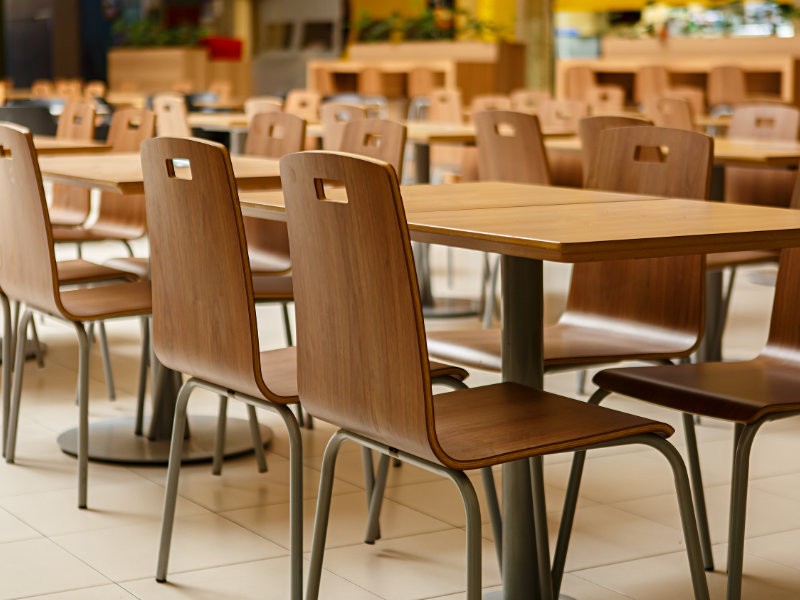
Locate an element on the screen. The height and width of the screenshot is (600, 800). wooden table is located at coordinates (557, 226), (114, 167), (56, 142), (736, 147), (434, 128), (218, 119).